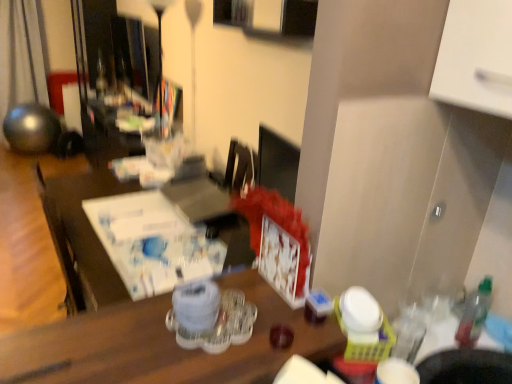
Question: Is translucent plastic bottle at right placed right next to clear plastic tray at center?

Choices:
 (A) no
 (B) yes

Answer: (A)

Question: Is translucent plastic bottle at right looking in the opposite direction of clear plastic tray at center?

Choices:
 (A) yes
 (B) no

Answer: (B)

Question: Does translucent plastic bottle at right have a greater height compared to clear plastic tray at center?

Choices:
 (A) no
 (B) yes

Answer: (B)

Question: Does translucent plastic bottle at right have a lesser width compared to clear plastic tray at center?

Choices:
 (A) yes
 (B) no

Answer: (A)

Question: From the image's perspective, is translucent plastic bottle at right above clear plastic tray at center?

Choices:
 (A) yes
 (B) no

Answer: (B)

Question: Considering their positions, is white paper at center located in front of or behind clear plastic tray at center?

Choices:
 (A) front
 (B) behind

Answer: (B)

Question: Would you say white paper at center is inside or outside clear plastic tray at center?

Choices:
 (A) outside
 (B) inside

Answer: (A)

Question: Visually, is white paper at center positioned to the left or to the right of clear plastic tray at center?

Choices:
 (A) right
 (B) left

Answer: (B)

Question: In terms of height, does white paper at center look taller or shorter compared to clear plastic tray at center?

Choices:
 (A) tall
 (B) short

Answer: (B)

Question: From the image's perspective, is translucent plastic bottle at right positioned above or below clear plastic tray at center?

Choices:
 (A) above
 (B) below

Answer: (B)

Question: In the image, is translucent plastic bottle at right positioned in front of or behind clear plastic tray at center?

Choices:
 (A) behind
 (B) front

Answer: (A)

Question: From a real-world perspective, relative to clear plastic tray at center, is translucent plastic bottle at right vertically above or below?

Choices:
 (A) below
 (B) above

Answer: (A)

Question: Based on their positions, is translucent plastic bottle at right located to the left or right of clear plastic tray at center?

Choices:
 (A) left
 (B) right

Answer: (B)

Question: Is metallic sphere at left wider or thinner than clear plastic tray at center?

Choices:
 (A) thin
 (B) wide

Answer: (B)

Question: From their relative heights in the image, would you say metallic sphere at left is taller or shorter than clear plastic tray at center?

Choices:
 (A) tall
 (B) short

Answer: (A)